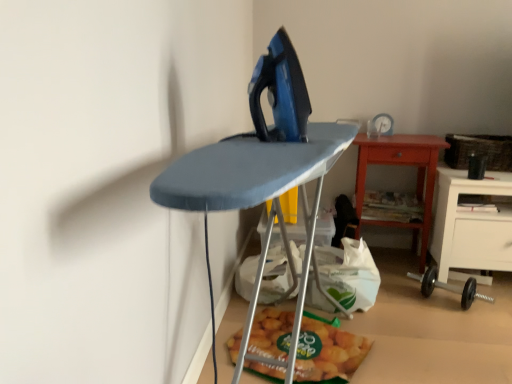
Question: Is woven brown basket at right to the left of matte plastic bag of chips at lower center from the viewer's perspective?

Choices:
 (A) no
 (B) yes

Answer: (A)

Question: From the image's perspective, is woven brown basket at right below matte plastic bag of chips at lower center?

Choices:
 (A) no
 (B) yes

Answer: (A)

Question: Are woven brown basket at right and matte plastic bag of chips at lower center beside each other?

Choices:
 (A) yes
 (B) no

Answer: (B)

Question: From the image's perspective, is woven brown basket at right over matte plastic bag of chips at lower center?

Choices:
 (A) yes
 (B) no

Answer: (A)

Question: Could you tell me if woven brown basket at right is facing matte plastic bag of chips at lower center?

Choices:
 (A) no
 (B) yes

Answer: (A)

Question: Is woven brown basket at right positioned beyond the bounds of matte plastic bag of chips at lower center?

Choices:
 (A) yes
 (B) no

Answer: (A)

Question: Can you confirm if wooden table at center right is wider than black rubber dumbbell at lower right?

Choices:
 (A) yes
 (B) no

Answer: (A)

Question: Is wooden table at center right to the right of black rubber dumbbell at lower right from the viewer's perspective?

Choices:
 (A) yes
 (B) no

Answer: (B)

Question: Is wooden table at center right smaller than black rubber dumbbell at lower right?

Choices:
 (A) no
 (B) yes

Answer: (A)

Question: Is the surface of wooden table at center right in direct contact with black rubber dumbbell at lower right?

Choices:
 (A) yes
 (B) no

Answer: (B)

Question: Is wooden table at center right further to camera compared to black rubber dumbbell at lower right?

Choices:
 (A) no
 (B) yes

Answer: (B)

Question: Are wooden table at center right and black rubber dumbbell at lower right located far from each other?

Choices:
 (A) no
 (B) yes

Answer: (A)

Question: Is matte plastic bag of chips at lower center taller than black rubber dumbbell at lower right?

Choices:
 (A) no
 (B) yes

Answer: (A)